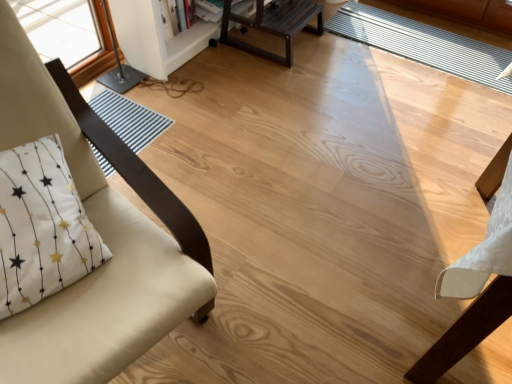
This screenshot has height=384, width=512. In order to click on free space in front of white striped mat at center in this screenshot , I will do `click(433, 104)`.